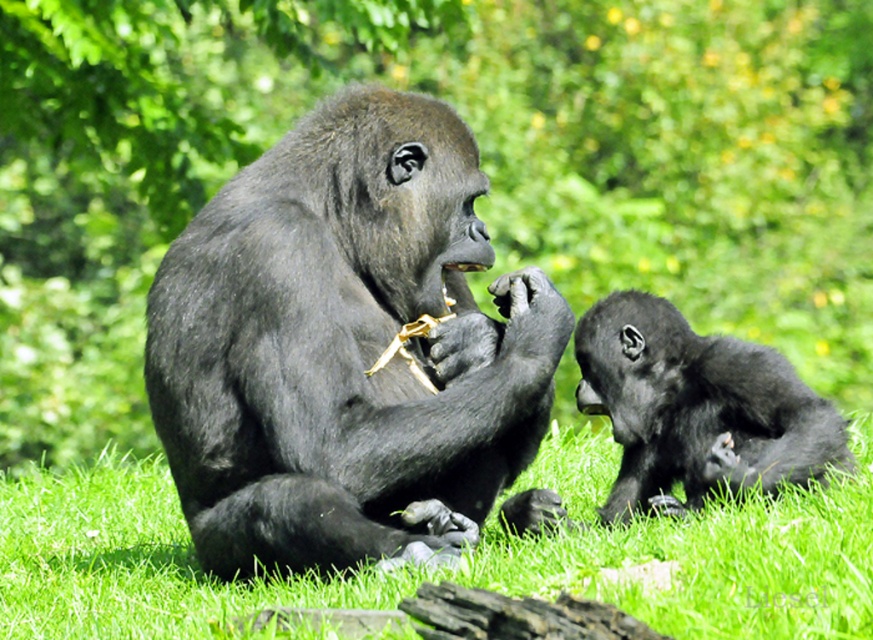
Can you confirm if green leafy tree at upper center is wider than green grass at lower center?

No.

Which is below, green leafy tree at upper center or green grass at lower center?

Positioned lower is green grass at lower center.

Does point (142, 163) come behind point (709, 632)?

Yes, it is.

Where is `green leafy tree at upper center`? green leafy tree at upper center is located at coordinates pyautogui.click(x=483, y=164).

The height and width of the screenshot is (640, 873). What are the coordinates of `green leafy tree at upper center` in the screenshot? It's located at (483, 164).

In the scene shown: Can you confirm if green leafy tree at upper center is taller than shiny black gorilla at center?

Incorrect, green leafy tree at upper center's height is not larger of shiny black gorilla at center's.

Does point (188, 20) lie in front of point (377, 177)?

No, it is not.

Identify the location of green leafy tree at upper center. (483, 164).

Between point (349, 528) and point (643, 544), which one is positioned behind?

Point (643, 544)

Does point (349, 99) lie behind point (203, 612)?

That is True.

Who is more distant from viewer, (231,365) or (313,602)?

Point (231,365)

The height and width of the screenshot is (640, 873). I want to click on shiny black gorilla at center, so click(x=346, y=348).